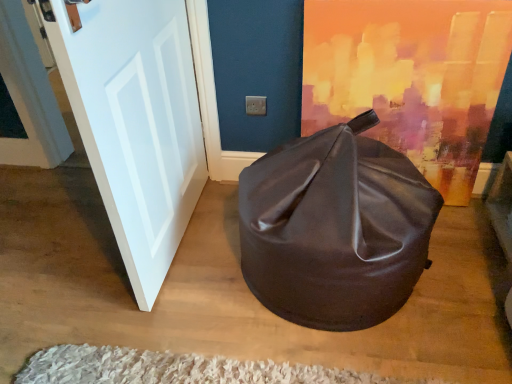
Find the location of a particular element. The image size is (512, 384). white shaggy rug at lower center is located at coordinates (177, 369).

The image size is (512, 384). What are the coordinates of `white glossy door at left` in the screenshot? It's located at (135, 121).

Could you tell me if white glossy door at left is turned towards shiny brown bean bag at center?

No, white glossy door at left is not turned towards shiny brown bean bag at center.

Who is bigger, white glossy door at left or shiny brown bean bag at center?

Bigger between the two is shiny brown bean bag at center.

Is white glossy door at left shorter than shiny brown bean bag at center?

No, white glossy door at left is not shorter than shiny brown bean bag at center.

Is point (108, 198) positioned before point (406, 286)?

That is True.

Considering the relative sizes of shiny brown bean bag at center and white shaggy rug at lower center in the image provided, is shiny brown bean bag at center smaller than white shaggy rug at lower center?

No.

Is shiny brown bean bag at center at the left side of white shaggy rug at lower center?

In fact, shiny brown bean bag at center is to the right of white shaggy rug at lower center.

Would you say shiny brown bean bag at center is inside or outside white shaggy rug at lower center?

The correct answer is: outside.

The width and height of the screenshot is (512, 384). Identify the location of bean bag chair above the white shaggy rug at lower center (from a real-world perspective). (335, 228).

Considering the sizes of white shaggy rug at lower center and shiny brown bean bag at center in the image, is white shaggy rug at lower center taller or shorter than shiny brown bean bag at center?

In the image, white shaggy rug at lower center appears to be shorter than shiny brown bean bag at center.

Between white shaggy rug at lower center and shiny brown bean bag at center, which one has larger size?

Bigger between the two is shiny brown bean bag at center.

Considering the positions of point (238, 375) and point (330, 142), is point (238, 375) closer or farther from the camera than point (330, 142)?

Point (238, 375) is closer to the camera than point (330, 142).

From a real-world perspective, is white shaggy rug at lower center below shiny brown bean bag at center?

Yes, from a real-world perspective, white shaggy rug at lower center is below shiny brown bean bag at center.

How different are the orientations of white shaggy rug at lower center and white glossy door at left in degrees?

They differ by 1.27 degrees in their facing directions.

Which is more to the left, white shaggy rug at lower center or white glossy door at left?

Positioned to the left is white glossy door at left.

From the picture: Is white shaggy rug at lower center positioned with its back to white glossy door at left?

No, white shaggy rug at lower center is not facing away from white glossy door at left.

Who is smaller, white shaggy rug at lower center or white glossy door at left?

white shaggy rug at lower center is smaller.

Considering the positions of objects shiny brown bean bag at center and white glossy door at left in the image provided, who is behind, shiny brown bean bag at center or white glossy door at left?

Positioned behind is shiny brown bean bag at center.

From the picture: From the image's perspective, is shiny brown bean bag at center over white glossy door at left?

No.

Is point (401, 201) farther from camera compared to point (136, 121)?

Yes.

Based on the photo, from a real-world perspective, is white glossy door at left positioned above or below white shaggy rug at lower center?

From a real-world perspective, white glossy door at left is physically above white shaggy rug at lower center.

Which object is positioned more to the left, white glossy door at left or white shaggy rug at lower center?

white glossy door at left.

Find the location of `bean bag chair that appears behind the white glossy door at left`. bean bag chair that appears behind the white glossy door at left is located at coordinates 335,228.

The height and width of the screenshot is (384, 512). I want to click on bean bag chair that is above the white shaggy rug at lower center (from the image's perspective), so click(x=335, y=228).

Looking at the image, which one is located closer to white shaggy rug at lower center, shiny brown bean bag at center or white glossy door at left?

shiny brown bean bag at center is positioned closer to the anchor white shaggy rug at lower center.

From the image, which object appears to be nearer to white shaggy rug at lower center, white glossy door at left or shiny brown bean bag at center?

Among the two, shiny brown bean bag at center is located nearer to white shaggy rug at lower center.

From the image, which object appears to be farther from shiny brown bean bag at center, white shaggy rug at lower center or white glossy door at left?

white glossy door at left is further to shiny brown bean bag at center.

Looking at the image, which one is located further to shiny brown bean bag at center, white glossy door at left or white shaggy rug at lower center?

white glossy door at left.

From the image, which object appears to be nearer to white glossy door at left, white shaggy rug at lower center or shiny brown bean bag at center?

shiny brown bean bag at center is closer to white glossy door at left.

When comparing their distances from white glossy door at left, does shiny brown bean bag at center or white shaggy rug at lower center seem further?

Based on the image, white shaggy rug at lower center appears to be further to white glossy door at left.

Locate an element on the screen. bean bag chair between white glossy door at left and white shaggy rug at lower center in the vertical direction is located at coordinates (335, 228).